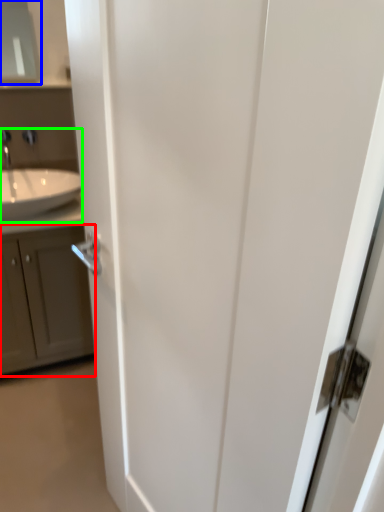
Question: Estimate the real-world distances between objects in this image. Which object is farther from cabinetry (highlighted by a red box), medicine cabinet (highlighted by a blue box) or sink (highlighted by a green box)?

Choices:
 (A) medicine cabinet
 (B) sink

Answer: (A)